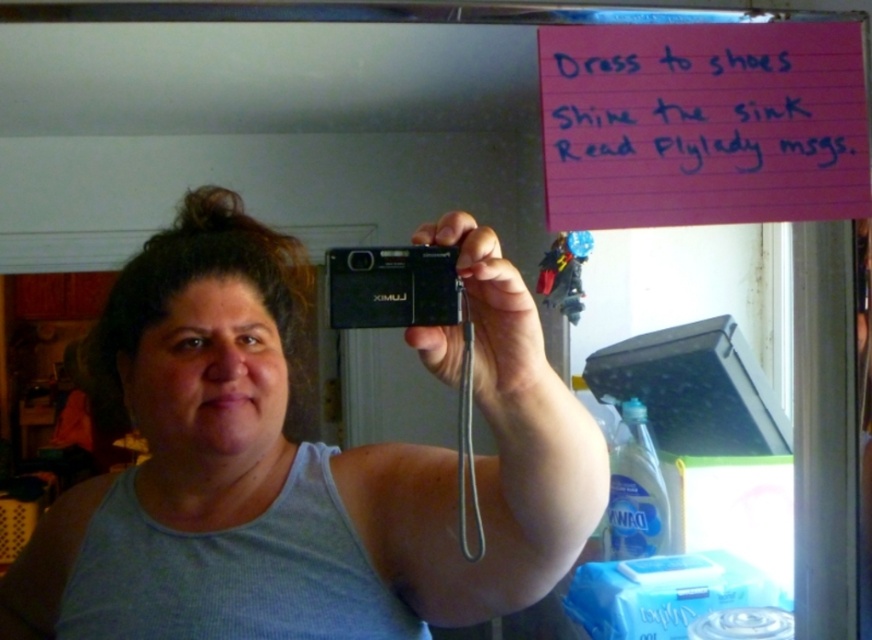
Is point (2, 596) more distant than point (451, 289)?

Yes, it is behind point (451, 289).

The width and height of the screenshot is (872, 640). Find the location of `matte black camera at upper center`. matte black camera at upper center is located at coordinates (298, 465).

Does pink paper at upper right have a greater width compared to black plastic camera at upper center?

Indeed, pink paper at upper right has a greater width compared to black plastic camera at upper center.

Is pink paper at upper right shorter than black plastic camera at upper center?

No.

Does point (780, 164) come behind point (421, 244)?

Yes.

Identify the location of pink paper at upper right. (703, 108).

Who is shorter, matte black camera at upper center or pink paper at upper right?

Standing shorter between the two is pink paper at upper right.

Between matte black camera at upper center and pink paper at upper right, which one appears on the right side from the viewer's perspective?

From the viewer's perspective, pink paper at upper right appears more on the right side.

You are a GUI agent. You are given a task and a screenshot of the screen. Output one action in this format:
    pyautogui.click(x=<x>, y=<y>)
    Task: Click on the matte black camera at upper center
    This screenshot has width=872, height=640.
    Given the screenshot: What is the action you would take?
    pyautogui.click(x=298, y=465)

You are a GUI agent. You are given a task and a screenshot of the screen. Output one action in this format:
    pyautogui.click(x=<x>, y=<y>)
    Task: Click on the matte black camera at upper center
    The height and width of the screenshot is (640, 872).
    Given the screenshot: What is the action you would take?
    298,465